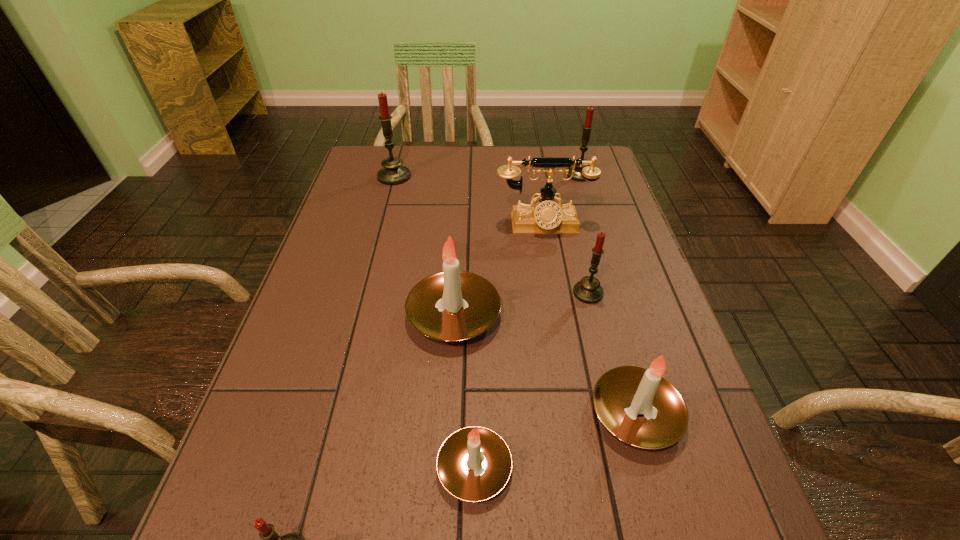
The width and height of the screenshot is (960, 540). I want to click on blank area located 0.340m on the front of the second biggest red candle, so click(x=604, y=252).

Identify the location of vacant space located 0.160m on the front of the biggest white candle. The height and width of the screenshot is (540, 960). (447, 425).

At what (x,y) coordinates should I click in order to perform the action: click on free region located on the dial of the sixth nearest object. Please return your answer as a coordinate pair (x, y). This screenshot has height=540, width=960. Looking at the image, I should click on (558, 311).

Locate an element on the screen. The width and height of the screenshot is (960, 540). blank area located 0.220m on the front of the third biggest red candle is located at coordinates tap(612, 387).

At what (x,y) coordinates should I click in order to perform the action: click on free space located 0.380m on the left of the rightmost white candle. Please return your answer as a coordinate pair (x, y). The image size is (960, 540). Looking at the image, I should click on (385, 414).

Where is `vacant space located on the left of the smallest white candle`? vacant space located on the left of the smallest white candle is located at coordinates (283, 468).

Locate an element on the screen. object that is at the left edge is located at coordinates (393, 173).

Find the location of a particular element. telephone located at the right edge is located at coordinates (546, 217).

You are a GUI agent. You are given a task and a screenshot of the screen. Output one action in this format:
    pyautogui.click(x=<x>, y=<y>)
    Task: Click on the object that is at the far left corner
    This screenshot has height=540, width=960.
    Given the screenshot: What is the action you would take?
    pyautogui.click(x=393, y=173)

Find the location of a particular element. The height and width of the screenshot is (540, 960). object situated at the far right corner is located at coordinates (587, 127).